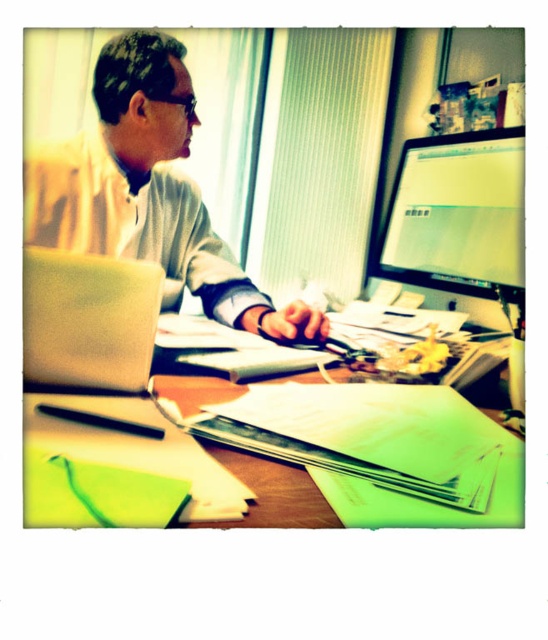
Looking at this image, you are trying to reach the black matte pen at lower center from where you are standing behind the wooden desk at center. Can you easily grab it without moving your chair?

The wooden desk at center is closer to the viewer than the black matte pen at lower center, so the pen is farther away. You would need to move your chair or stretch to reach it.

Consider the image. You are organizing a small party and need to place a 1.2 meter long tablecloth on the wooden desk at center. Based on the scene, will the matte gray sweater at center fit on the tablecloth without hanging off the edges?

The matte gray sweater at center has a width larger than the wooden desk at center, so placing it on a 1.2 meter tablecloth might not be sufficient if the sweater is wider than the desk. However, since the desk itself is under the tablecloth, the sweater would only need to fit within the desk dimensions. Therefore, the sweater may still hang off the tablecloth if its width exceeds the desk, but the desk supports it.

You are organizing your desk and need to place the black matte pen at lower center closer to the wooden desk at center. How much closer can you move them?

The current distance between the wooden desk at center and the black matte pen at lower center is 20.90 centimeters. To move them closer, you can reduce this distance, but you cannot make it less than zero. The maximum possible reduction would be 20.90 centimeters, bringing them into direct contact.